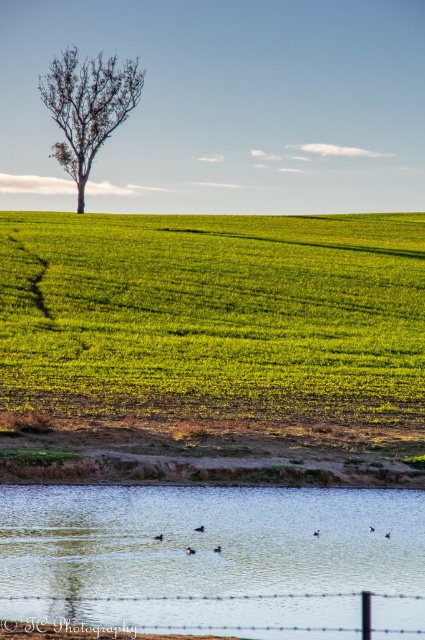
Based on the photo, you are standing at the edge of the field and want to cross to the other side. There is a clear water at lower center and a barbed wire fence at lower center. How far apart are these two obstacles from each other?

The clear water at lower center and the barbed wire fence at lower center are 16.98 feet apart.

You are standing on the edge of the green grassy field at center and want to walk to the bare brown tree at upper left. Which direction should you head?

The bare brown tree at upper left is located to the upper left of the green grassy field at center, so you should head in the upper left direction to reach it.